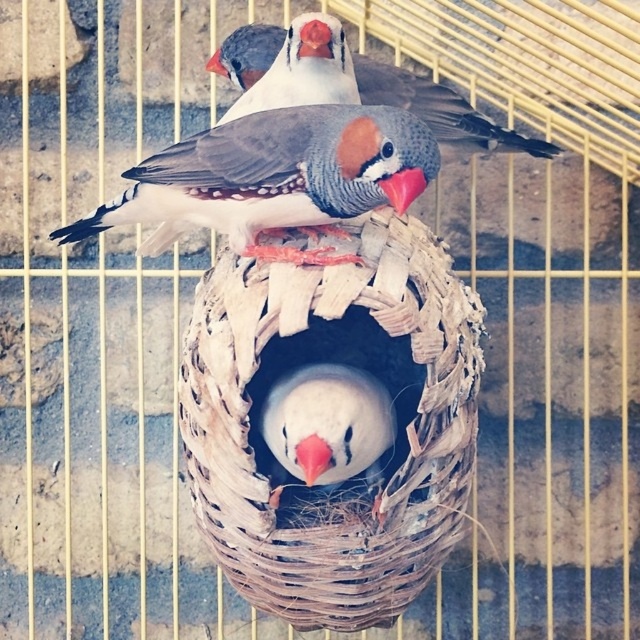
You are a bird enthusiast observing the image. You notice the woven straw nest at center and the speckled feathered bird at center. Which object occupies more space in the image?

The woven straw nest at center is bigger than the speckled feathered bird at center, so the nest occupies more space in the image.

You are a bird trainer who needs to place a 40 cm long ladder between the white matte bird at center and the speckled feathered bird at upper center. Will the ladder reach both birds?

The distance between the white matte bird at center and the speckled feathered bird at upper center is 39.99 centimeters. Since the ladder is 40 cm long, it will be just long enough to reach both birds.

You are a small toy that wants to land on the woven straw nest at center without disturbing the speckled feathered bird at upper center. Can you fit underneath the bird?

The woven straw nest at center is taller than the speckled feathered bird at upper center, so yes, the toy can fit underneath the bird as there is enough vertical space between them.